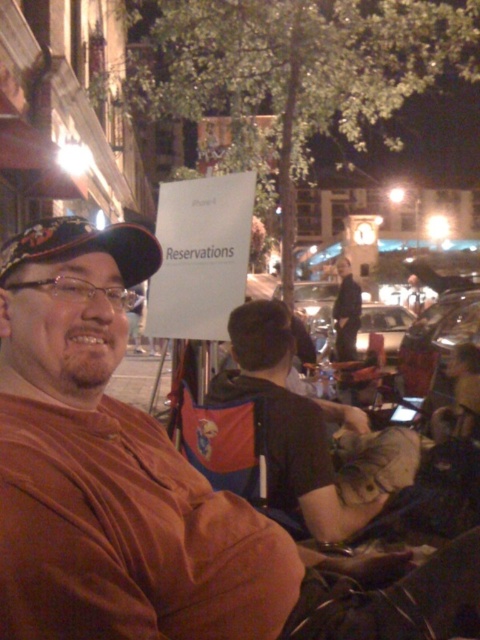
You are standing in the nighttime scene of the restaurant. You see a black fabric chair at center and a dark blue suit at center. Which object is positioned to the left?

The black fabric chair at center is to the left of the dark blue suit at center.

You are standing in the nighttime scene at the restaurant. You see a man taking a selfie wearing a brown cotton shirt at center. Where is the man located relative to the point marked as coordinates (145, 484)?

The point (145, 484) corresponds to the brown cotton shirt at center, so the man is located at that point.